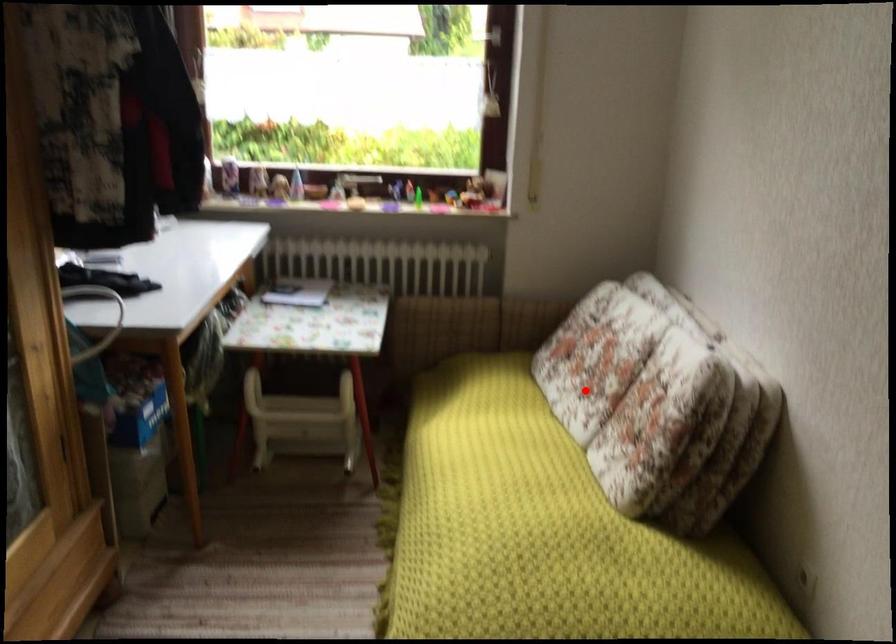
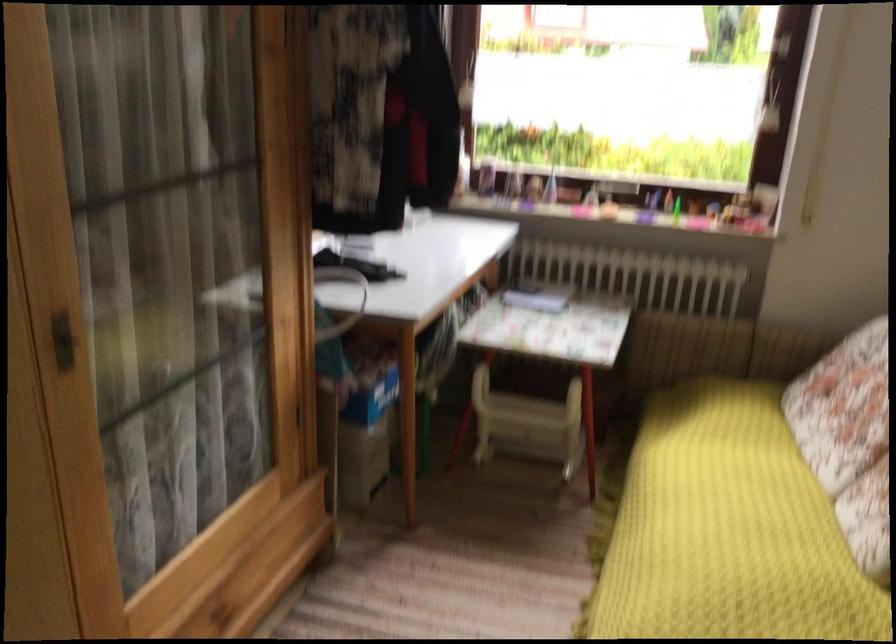
Question: I am providing you with two images of the same scene from different viewpoints. Given a red point in image1, look at the same physical point in image2. Is it:

Choices:
 (A) Closer to the viewpoint
 (B) Farther from the viewpoint

Answer: (A)